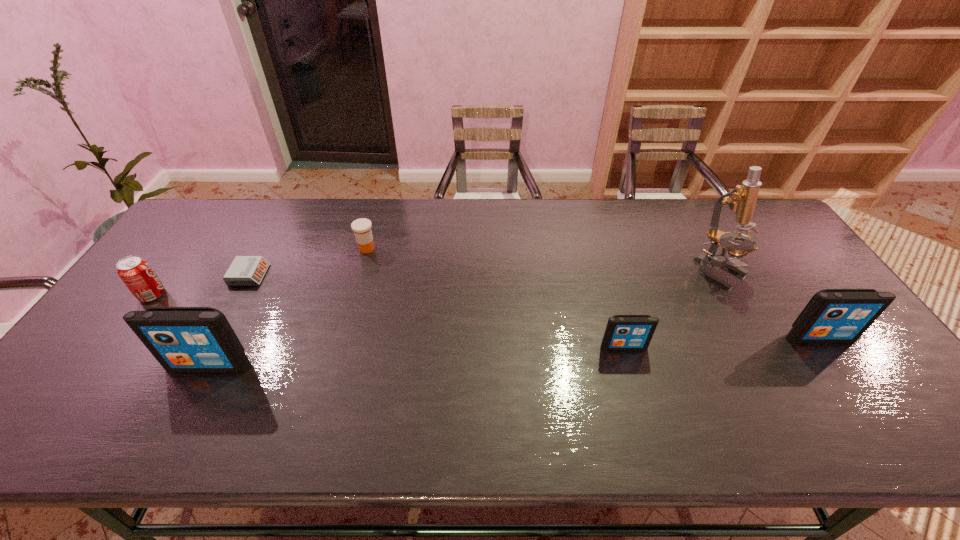
This screenshot has height=540, width=960. I want to click on microscope, so click(742, 199).

Locate an element on the screen. Image resolution: width=960 pixels, height=540 pixels. free location located on the front screen of the nearest object is located at coordinates (192, 399).

This screenshot has height=540, width=960. Identify the location of free space located 0.080m on the front screen of the second iPod from left to right. (633, 377).

I want to click on vacant space located 0.150m on the front screen of the second shortest iPod, so click(x=859, y=395).

You are a GUI agent. You are given a task and a screenshot of the screen. Output one action in this format:
    pyautogui.click(x=<x>, y=<y>)
    Task: Click on the free space located on the label of the fourth object from right to left
    Image resolution: width=960 pixels, height=540 pixels.
    Given the screenshot: What is the action you would take?
    pyautogui.click(x=404, y=248)

Where is `vacant area situated 0.150m on the front of the alarm clock`? This screenshot has width=960, height=540. vacant area situated 0.150m on the front of the alarm clock is located at coordinates (222, 326).

Where is `blank space located on the back of the soda`? This screenshot has width=960, height=540. blank space located on the back of the soda is located at coordinates (168, 274).

Where is `free space located 0.330m on the left of the tallest object`? The height and width of the screenshot is (540, 960). free space located 0.330m on the left of the tallest object is located at coordinates (588, 271).

Identify the location of object that is at the near edge. (182, 339).

Find the location of a particular element. object that is at the left edge is located at coordinates tap(136, 273).